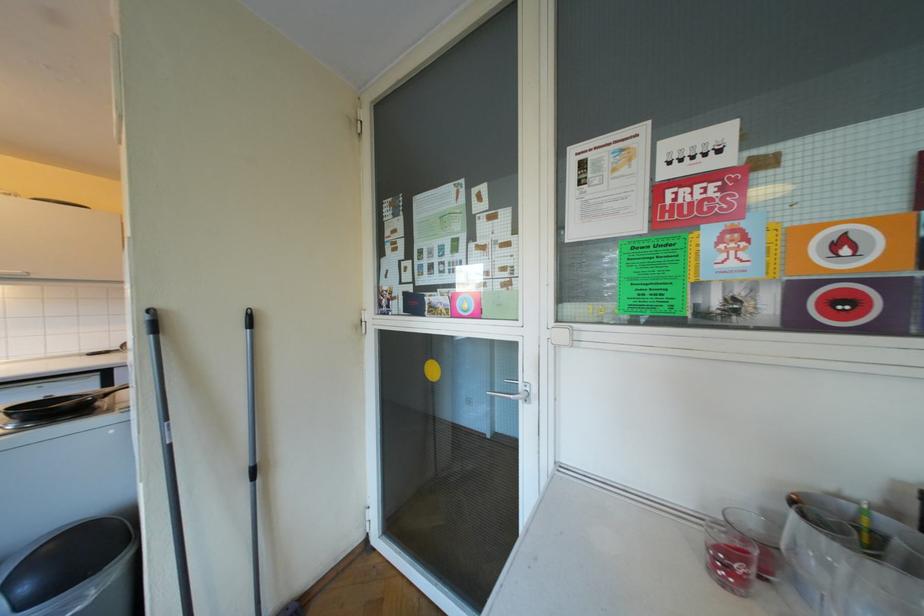
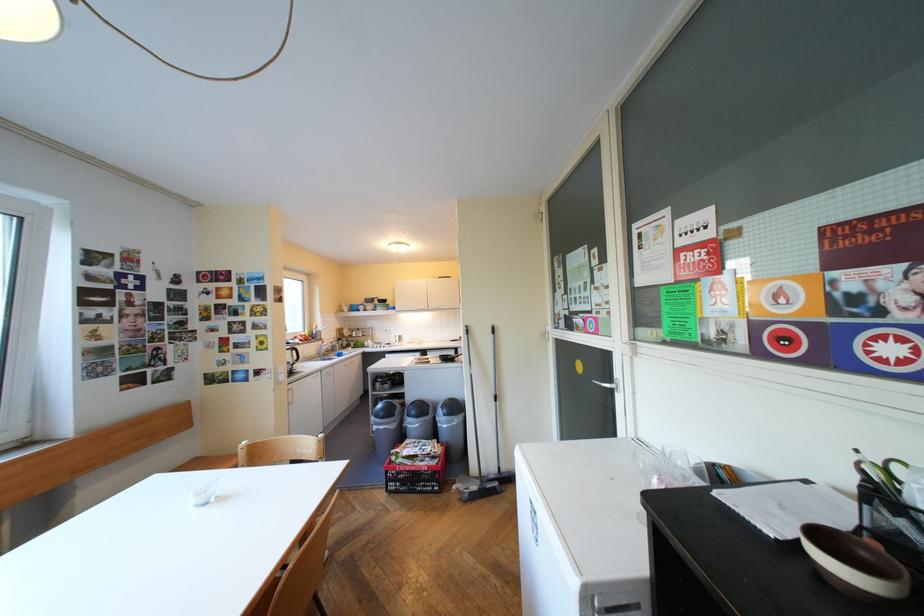
Find the pixel in the second image that matches point (107, 589) in the first image.

(469, 419)